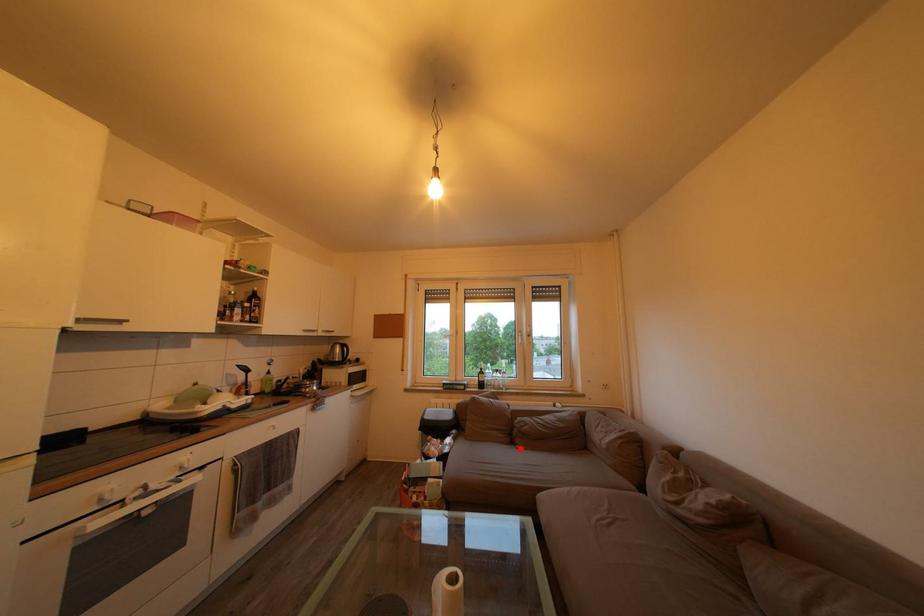
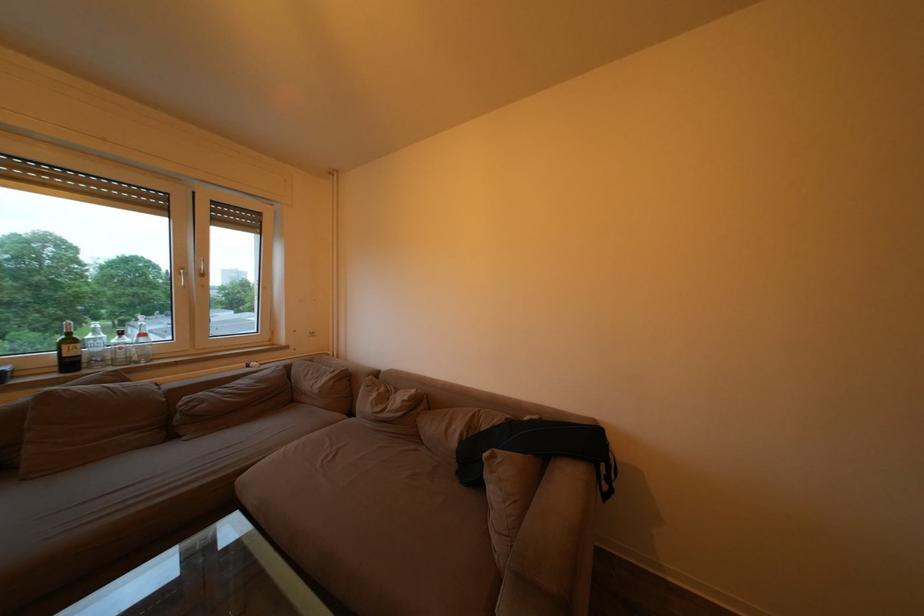
Question: I am providing you with two images of the same scene from different viewpoints. A red point is shown in image1. For the corresponding object point in image2, is it positioned nearer or farther from the camera?

Choices:
 (A) Nearer
 (B) Farther

Answer: (A)